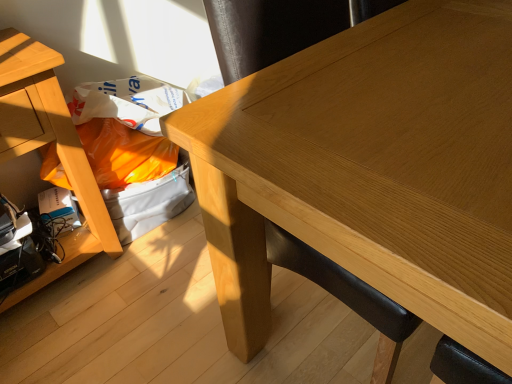
What is the approximate width of light brown wood table at left, which appears as the 1th table when viewed from the left?

39.11 centimeters.

At what (x,y) coordinates should I click in order to perform the action: click on light brown wood table at left, positioned as the second table in right-to-left order. Please return your answer as a coordinate pair (x, y). Looking at the image, I should click on (47, 143).

Image resolution: width=512 pixels, height=384 pixels. What do you see at coordinates (47, 143) in the screenshot?
I see `light brown wood table at left, which appears as the 1th table when viewed from the left` at bounding box center [47, 143].

How much space does light brown wood table at center, which ranks as the first table in right-to-left order, occupy horizontally?

light brown wood table at center, which ranks as the first table in right-to-left order, is 26.21 inches wide.

You are a GUI agent. You are given a task and a screenshot of the screen. Output one action in this format:
    pyautogui.click(x=<x>, y=<y>)
    Task: Click on the light brown wood table at center, which ranks as the first table in right-to-left order
    
    Given the screenshot: What is the action you would take?
    pyautogui.click(x=370, y=169)

What do you see at coordinates (370, 169) in the screenshot?
I see `light brown wood table at center, which ranks as the first table in right-to-left order` at bounding box center [370, 169].

I want to click on light brown wood table at left, positioned as the second table in right-to-left order, so pyautogui.click(x=47, y=143).

Is light brown wood table at left, positioned as the second table in right-to-left order, to the left of light brown wood table at center, arranged as the second table when viewed from the left, from the viewer's perspective?

Correct, you'll find light brown wood table at left, positioned as the second table in right-to-left order, to the left of light brown wood table at center, arranged as the second table when viewed from the left.

Which object is more forward, light brown wood table at left, positioned as the second table in right-to-left order, or light brown wood table at center, which ranks as the first table in right-to-left order?

light brown wood table at center, which ranks as the first table in right-to-left order, is more forward.

Does point (10, 298) appear closer or farther from the camera than point (433, 288)?

Point (10, 298) is positioned farther from the camera compared to point (433, 288).

Looking at this image, from the image's perspective, relative to light brown wood table at center, arranged as the second table when viewed from the left, is light brown wood table at left, which appears as the 1th table when viewed from the left, above or below?

light brown wood table at left, which appears as the 1th table when viewed from the left, is below light brown wood table at center, arranged as the second table when viewed from the left.

From a real-world perspective, relative to light brown wood table at center, which ranks as the first table in right-to-left order, is light brown wood table at left, positioned as the second table in right-to-left order, vertically above or below?

From a real-world perspective, light brown wood table at left, positioned as the second table in right-to-left order, is physically below light brown wood table at center, which ranks as the first table in right-to-left order.

Is light brown wood table at left, positioned as the second table in right-to-left order, thinner than light brown wood table at center, arranged as the second table when viewed from the left?

Yes, light brown wood table at left, positioned as the second table in right-to-left order, is thinner than light brown wood table at center, arranged as the second table when viewed from the left.

Who is taller, light brown wood table at left, positioned as the second table in right-to-left order, or light brown wood table at center, arranged as the second table when viewed from the left?

Standing taller between the two is light brown wood table at center, arranged as the second table when viewed from the left.

Based on their sizes in the image, would you say light brown wood table at left, which appears as the 1th table when viewed from the left, is bigger or smaller than light brown wood table at center, arranged as the second table when viewed from the left?

In the image, light brown wood table at left, which appears as the 1th table when viewed from the left, appears to be smaller than light brown wood table at center, arranged as the second table when viewed from the left.

Choose the correct answer: Is light brown wood table at left, positioned as the second table in right-to-left order, inside light brown wood table at center, arranged as the second table when viewed from the left, or outside it?

light brown wood table at left, positioned as the second table in right-to-left order, lies outside light brown wood table at center, arranged as the second table when viewed from the left.

Can you see light brown wood table at left, positioned as the second table in right-to-left order, touching light brown wood table at center, arranged as the second table when viewed from the left?

No, light brown wood table at left, positioned as the second table in right-to-left order, is not in contact with light brown wood table at center, arranged as the second table when viewed from the left.

Is light brown wood table at left, which appears as the 1th table when viewed from the left, facing towards light brown wood table at center, which ranks as the first table in right-to-left order?

No, light brown wood table at left, which appears as the 1th table when viewed from the left, does not turn towards light brown wood table at center, which ranks as the first table in right-to-left order.

Can you tell me how much light brown wood table at left, which appears as the 1th table when viewed from the left, and light brown wood table at center, arranged as the second table when viewed from the left, differ in facing direction?

The angle between the facing direction of light brown wood table at left, which appears as the 1th table when viewed from the left, and the facing direction of light brown wood table at center, arranged as the second table when viewed from the left, is 0.138 degrees.

The height and width of the screenshot is (384, 512). What are the coordinates of `table that appears above the light brown wood table at left, positioned as the second table in right-to-left order (from a real-world perspective)` in the screenshot? It's located at (370, 169).

Is light brown wood table at center, which ranks as the first table in right-to-left order, to the left of light brown wood table at left, positioned as the second table in right-to-left order, from the viewer's perspective?

In fact, light brown wood table at center, which ranks as the first table in right-to-left order, is to the right of light brown wood table at left, positioned as the second table in right-to-left order.

Is light brown wood table at center, which ranks as the first table in right-to-left order, in front of or behind light brown wood table at left, positioned as the second table in right-to-left order, in the image?

Visually, light brown wood table at center, which ranks as the first table in right-to-left order, is located in front of light brown wood table at left, positioned as the second table in right-to-left order.

Which is nearer, (286, 62) or (18, 149)?

Point (286, 62) is closer to the camera than point (18, 149).

From the image's perspective, relative to light brown wood table at left, which appears as the 1th table when viewed from the left, is light brown wood table at center, which ranks as the first table in right-to-left order, above or below?

light brown wood table at center, which ranks as the first table in right-to-left order, is above light brown wood table at left, which appears as the 1th table when viewed from the left.

From a real-world perspective, between light brown wood table at center, which ranks as the first table in right-to-left order, and light brown wood table at left, positioned as the second table in right-to-left order, who is vertically lower?

In real-world perspective, light brown wood table at left, positioned as the second table in right-to-left order, is lower.

Which of these two, light brown wood table at center, arranged as the second table when viewed from the left, or light brown wood table at left, positioned as the second table in right-to-left order, is wider?

Wider between the two is light brown wood table at center, arranged as the second table when viewed from the left.

Is light brown wood table at center, which ranks as the first table in right-to-left order, shorter than light brown wood table at left, positioned as the second table in right-to-left order?

Incorrect, the height of light brown wood table at center, which ranks as the first table in right-to-left order, does not fall short of that of light brown wood table at left, positioned as the second table in right-to-left order.

Considering the relative sizes of light brown wood table at center, arranged as the second table when viewed from the left, and light brown wood table at left, which appears as the 1th table when viewed from the left, in the image provided, is light brown wood table at center, arranged as the second table when viewed from the left, smaller than light brown wood table at left, which appears as the 1th table when viewed from the left,?

Incorrect, light brown wood table at center, arranged as the second table when viewed from the left, is not smaller in size than light brown wood table at left, which appears as the 1th table when viewed from the left.

Is light brown wood table at left, positioned as the second table in right-to-left order, located within light brown wood table at center, which ranks as the first table in right-to-left order?

Definitely not — light brown wood table at left, positioned as the second table in right-to-left order, is not inside light brown wood table at center, which ranks as the first table in right-to-left order.

Is light brown wood table at center, arranged as the second table when viewed from the left, with light brown wood table at left, positioned as the second table in right-to-left order?

No, light brown wood table at center, arranged as the second table when viewed from the left, is not making contact with light brown wood table at left, positioned as the second table in right-to-left order.

Is light brown wood table at center, arranged as the second table when viewed from the left, facing towards light brown wood table at left, positioned as the second table in right-to-left order?

No.

What's the angular difference between light brown wood table at center, arranged as the second table when viewed from the left, and light brown wood table at left, positioned as the second table in right-to-left order,'s facing directions?

There is a 0.138-degree angle between the facing directions of light brown wood table at center, arranged as the second table when viewed from the left, and light brown wood table at left, positioned as the second table in right-to-left order.

Find the location of a particular element. table that appears on the left of light brown wood table at center, arranged as the second table when viewed from the left is located at coordinates (47, 143).

Find the location of a particular element. This screenshot has width=512, height=384. table positioned vertically above the light brown wood table at left, positioned as the second table in right-to-left order (from a real-world perspective) is located at coordinates (370, 169).

Locate an element on the screen. This screenshot has height=384, width=512. table behind the light brown wood table at center, arranged as the second table when viewed from the left is located at coordinates (47, 143).